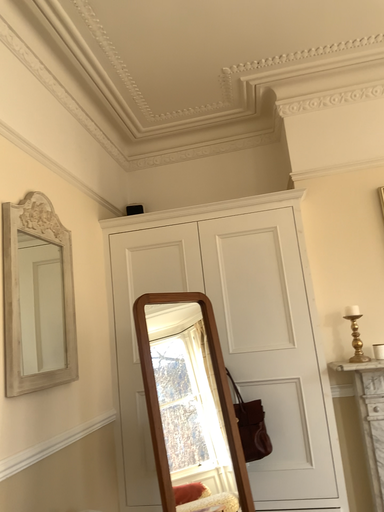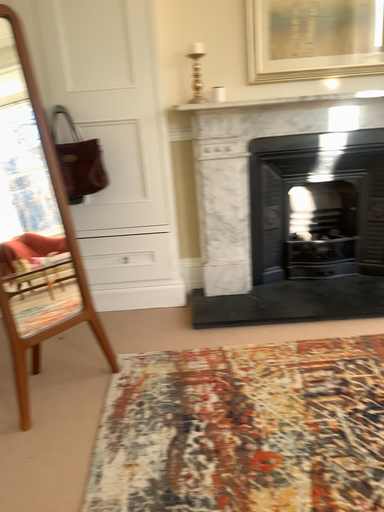
Question: How did the camera likely rotate when shooting the video?

Choices:
 (A) rotated upward
 (B) rotated downward

Answer: (B)